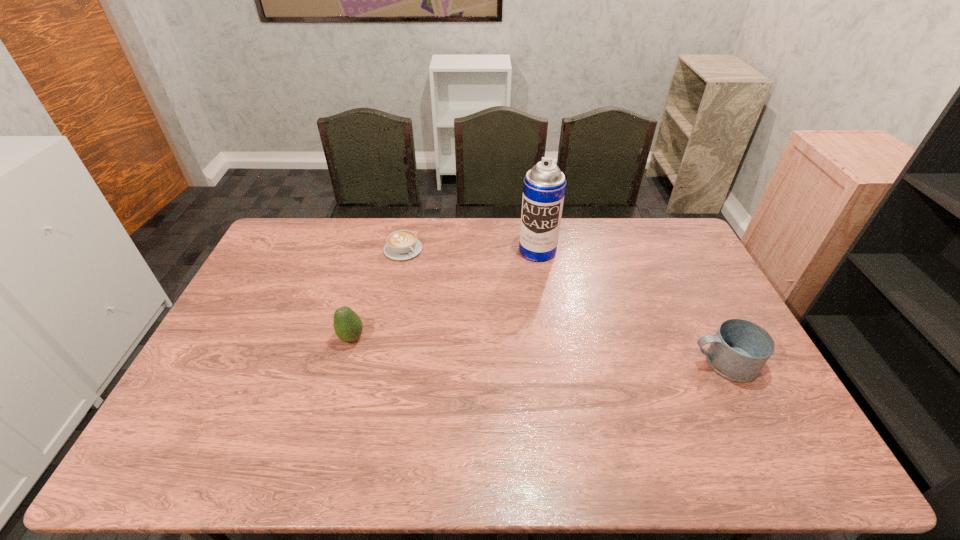
Locate an element on the screen. Image resolution: width=960 pixels, height=540 pixels. free space on the desktop that is between the avocado and the mug and is positioned on the label side of the tallest object is located at coordinates pyautogui.click(x=504, y=348).

The image size is (960, 540). I want to click on vacant space on the desktop that is between the avocado and the mug and is positioned on the side of the cappuccino with the handle, so (x=517, y=349).